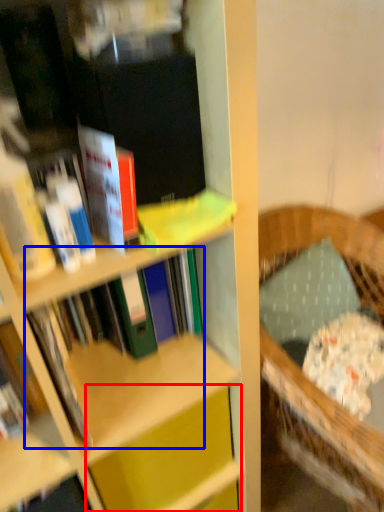
Question: Among these objects, which one is farthest to the camera, cabinet (highlighted by a red box) or book (highlighted by a blue box)?

Choices:
 (A) cabinet
 (B) book

Answer: (A)